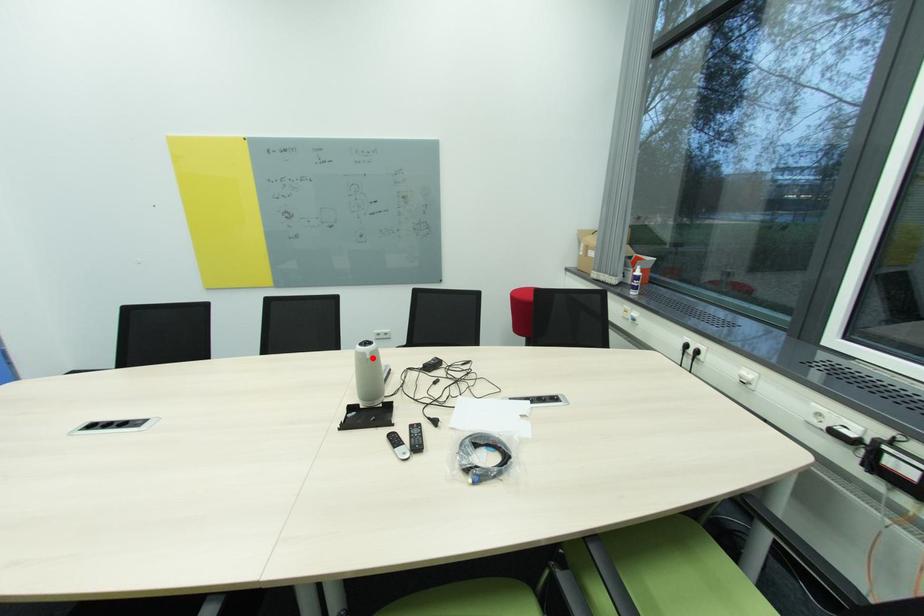
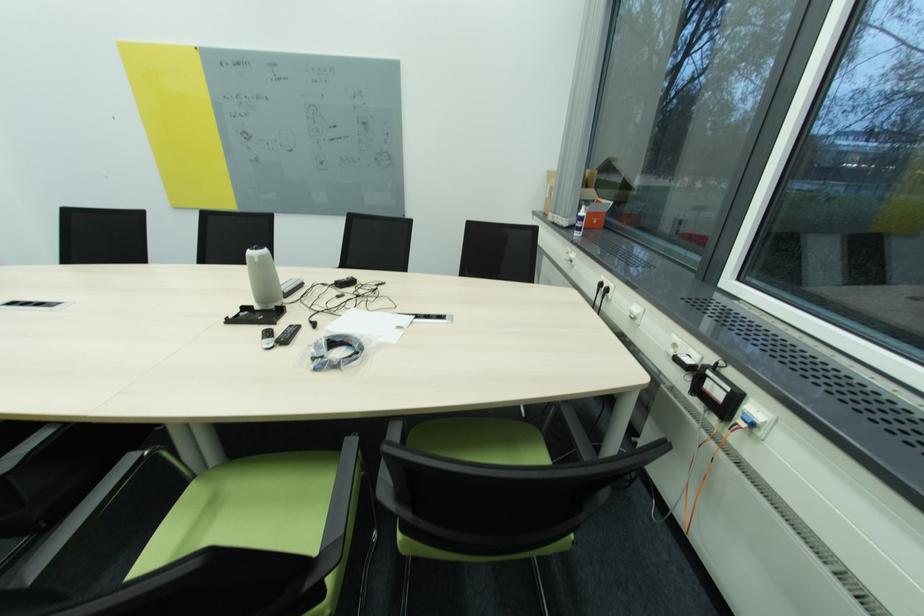
The point at the highlighted location is marked in the first image. Where is the corresponding point in the second image?

(261, 262)